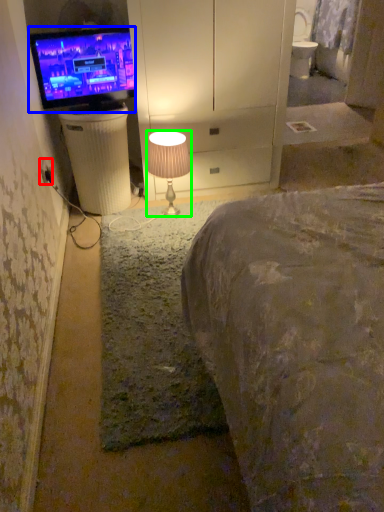
Question: Estimate the real-world distances between objects in this image. Which object is farther from electric outlet (highlighted by a red box), television (highlighted by a blue box) or lamp (highlighted by a green box)?

Choices:
 (A) television
 (B) lamp

Answer: (B)